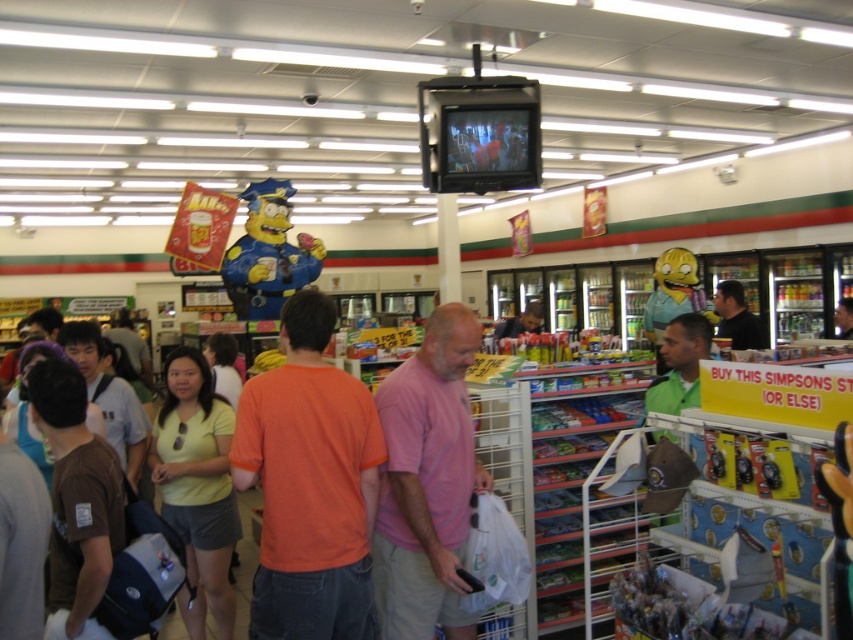
Who is more forward, (263, 244) or (659, 337)?

Point (659, 337) is more forward.

Who is more distant from viewer, (230, 280) or (677, 282)?

The point (230, 280) is behind.

Identify the location of blue painted cardboard simpson at center. The width and height of the screenshot is (853, 640). (268, 253).

Who is shorter, yellow matte shirt at lower left or yellow fabric homer simpson at center?

yellow fabric homer simpson at center is shorter.

Locate an element on the screen. The width and height of the screenshot is (853, 640). yellow matte shirt at lower left is located at coordinates (196, 486).

Locate an element on the screen. yellow matte shirt at lower left is located at coordinates (196, 486).

Measure the distance from orange cotton t-shirt at center to blue painted cardboard simpson at center.

orange cotton t-shirt at center is 15.18 feet from blue painted cardboard simpson at center.

Image resolution: width=853 pixels, height=640 pixels. Describe the element at coordinates (310, 484) in the screenshot. I see `orange cotton t-shirt at center` at that location.

Is point (283, 486) behind point (294, 256)?

That is False.

At what (x,y) coordinates should I click in order to perform the action: click on orange cotton t-shirt at center. Please return your answer as a coordinate pair (x, y). The image size is (853, 640). Looking at the image, I should click on (310, 484).